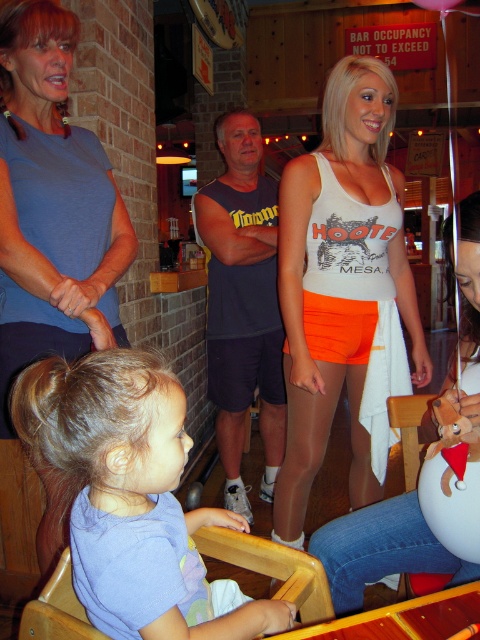
You are a photographer trying to capture a photo of the scene. You want to focus on the two points labeled as point (x=296, y=250) and point (x=85, y=436). Since you can only focus on one point at a time, which point should you choose to ensure the other point is still in acceptable focus range? The acceptable focus range is 0.2 units in depth. Please provide your answer based on their positions.

Point (x=296, y=250) is further to the camera than point (x=85, y=436). The distance between them is 0.438 units. Since the acceptable focus range is 0.2 units, you should focus on the closer point (x=85, y=436) to include both within the focus range.

You are a fashion designer observing the clothing items in the image. You need to determine if the purple cotton shirt at center and the white cotton tank top at center can be displayed side by side on a mannequin without overlapping. The mannequin has a 16 inch wide display area. Can they fit?

The distance between the purple cotton shirt at center and the white cotton tank top at center is 16.94 inches. Since the mannequin display area is only 16 inches wide, the two items would not fit side by side without overlapping.

In the scene shown: Where is the white tank top at center located in the image?

The white tank top at center is located at the 2D coordinates point (x=339, y=284).